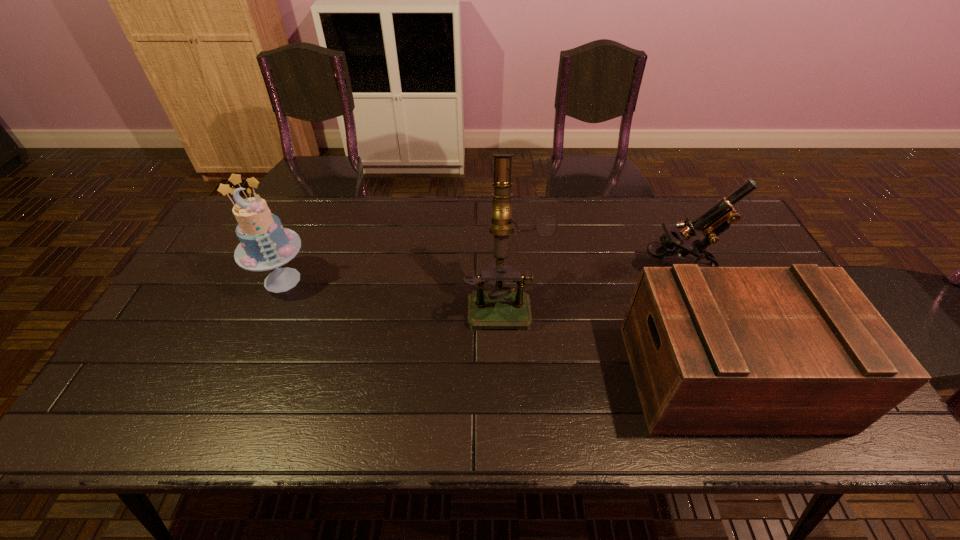
Find the location of a particular element. The image size is (960, 540). the third object from right to left is located at coordinates (503, 308).

Image resolution: width=960 pixels, height=540 pixels. Find the location of `the taller microscope`. the taller microscope is located at coordinates (503, 308).

I want to click on cake, so click(264, 245).

The width and height of the screenshot is (960, 540). In order to click on the right microscope in this screenshot , I will do `click(717, 219)`.

Find the location of a particular element. This screenshot has width=960, height=540. box is located at coordinates (714, 350).

Where is `vacant area situated at the eyepiece of the taller microscope`? The width and height of the screenshot is (960, 540). vacant area situated at the eyepiece of the taller microscope is located at coordinates (509, 370).

At what (x,y) coordinates should I click in order to perform the action: click on vacant space located with a ladder on the side of the cake. Please return your answer as a coordinate pair (x, y). The width and height of the screenshot is (960, 540). Looking at the image, I should click on (260, 331).

Where is `free space located through the eyepiece of the shorter microscope`? free space located through the eyepiece of the shorter microscope is located at coordinates (514, 269).

Where is `free location located 0.210m through the eyepiece of the shorter microscope`? The image size is (960, 540). free location located 0.210m through the eyepiece of the shorter microscope is located at coordinates (570, 269).

Image resolution: width=960 pixels, height=540 pixels. I want to click on vacant area located 0.210m through the eyepiece of the shorter microscope, so click(570, 269).